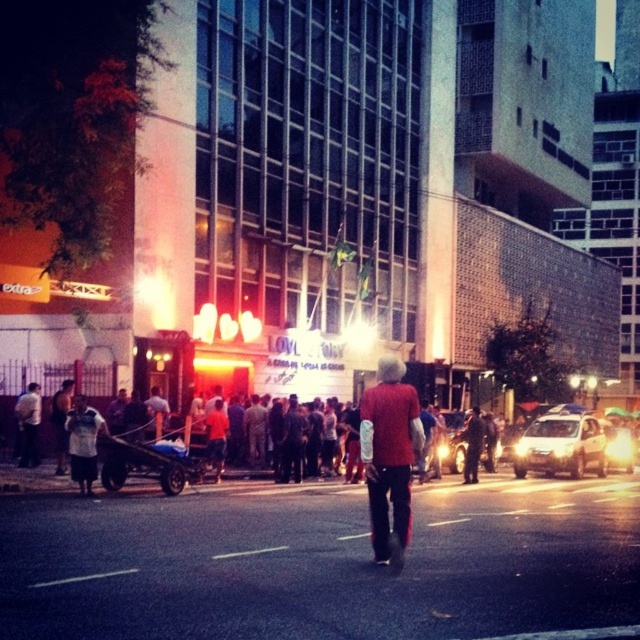
You are standing at the point marked by the coordinates point (x=561, y=445) in the image. What object are you directly facing?

You are directly facing the silver metallic sedan at center marked by the coordinates point (x=561, y=445).

You are standing at the center of the image and want to reach the silver metallic sedan at center. Which direction should you move to get there?

Since you are already at the center of the image, you are already at the location of the silver metallic sedan at center.

You are a photographer trying to capture the entire scene of the matte red sweater at center and the shiny silver sedan at center in one shot. Based on their sizes, will you need to zoom in or out to include both objects in the frame?

The matte red sweater at center is narrower than the shiny silver sedan at center. To capture both in one frame, you should zoom out to accommodate the wider sedan.